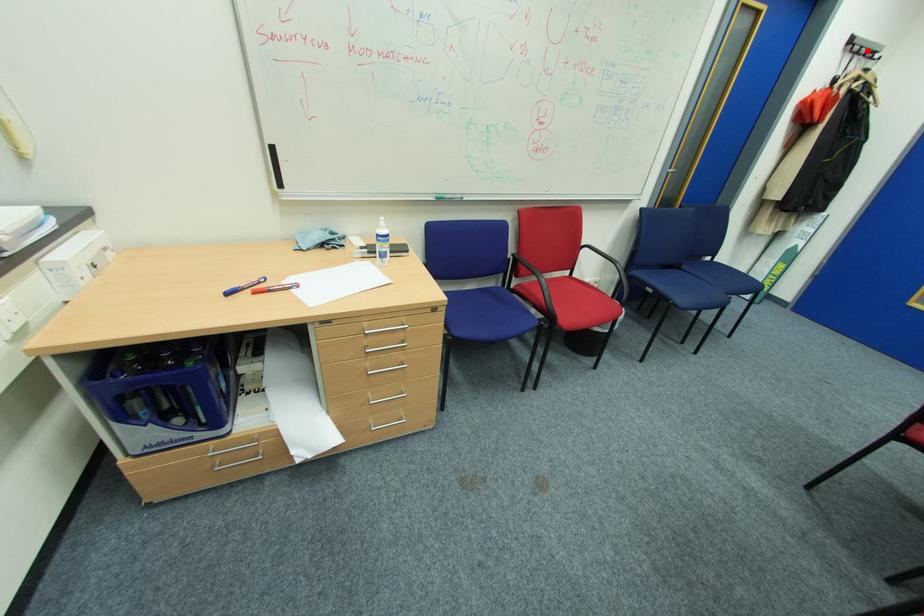
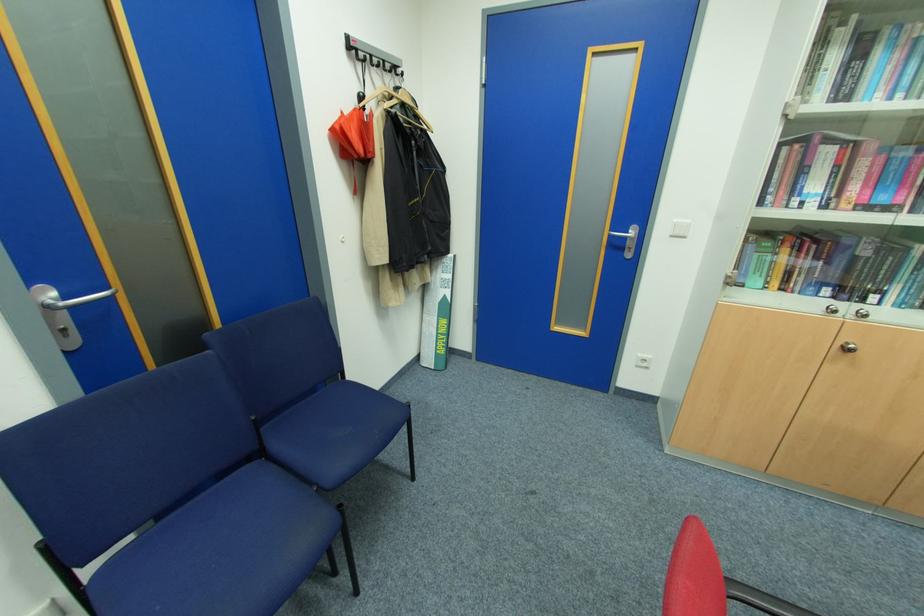
Where in the second image is the point corresponding to the highlighted location from the first image?

(380, 60)